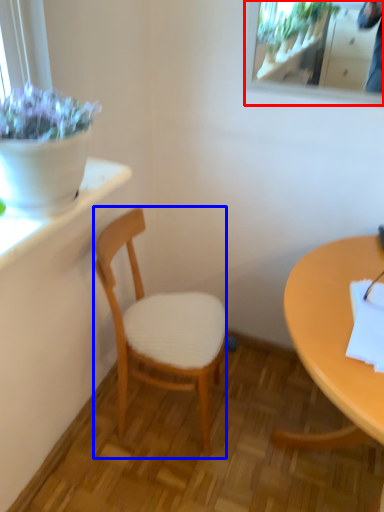
Question: Which object appears farthest to the camera in this image, mirror (highlighted by a red box) or chair (highlighted by a blue box)?

Choices:
 (A) mirror
 (B) chair

Answer: (A)